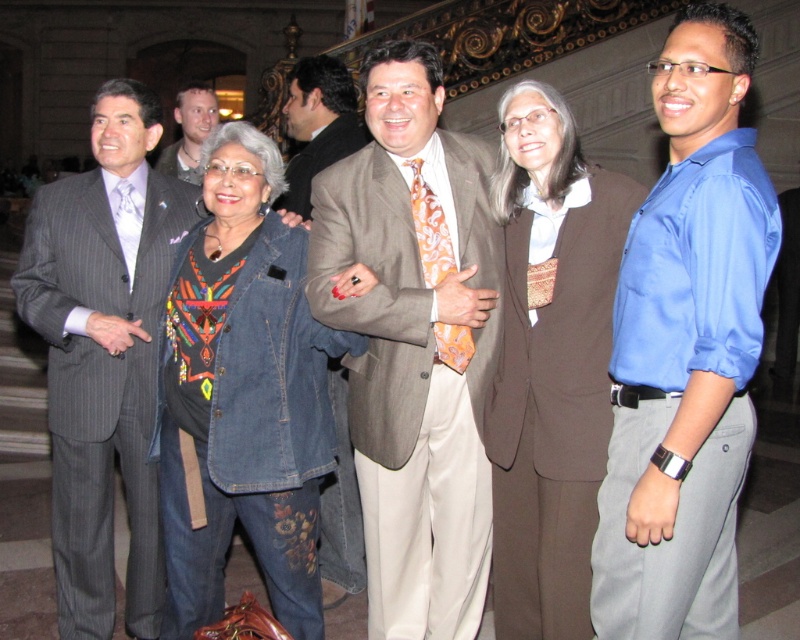
Question: Among these objects, which one is nearest to the camera?

Choices:
 (A) matte brown suit at center
 (B) light brown leather jacket at upper left

Answer: (A)

Question: Is denim jacket at center closer to camera compared to light brown leather jacket at upper left?

Choices:
 (A) yes
 (B) no

Answer: (A)

Question: Is matte brown suit at center above orange patterned tie at center?

Choices:
 (A) no
 (B) yes

Answer: (A)

Question: Estimate the real-world distances between objects in this image. Which object is closer to the gray pinstripe suit at left?

Choices:
 (A) brown textured suit at center
 (B) orange patterned tie at center

Answer: (B)

Question: Which object is the closest to the gray pinstripe suit at left?

Choices:
 (A) blue cotton shirt at right
 (B) denim jacket at center

Answer: (B)

Question: Does matte brown suit at center appear over orange patterned tie at center?

Choices:
 (A) no
 (B) yes

Answer: (A)